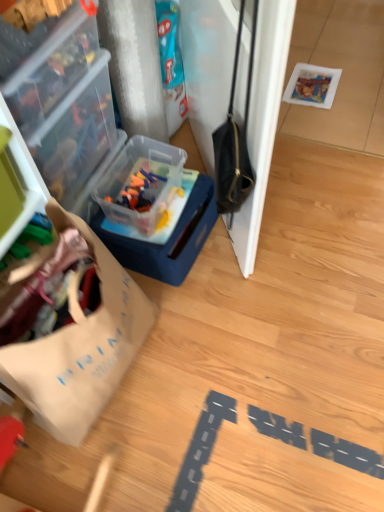
This screenshot has height=512, width=384. In order to click on empty space that is ontop of translucent plastic container at center-left, which appears as the 1th box when viewed from the right (from a real-world perspective) in this screenshot , I will do `click(165, 207)`.